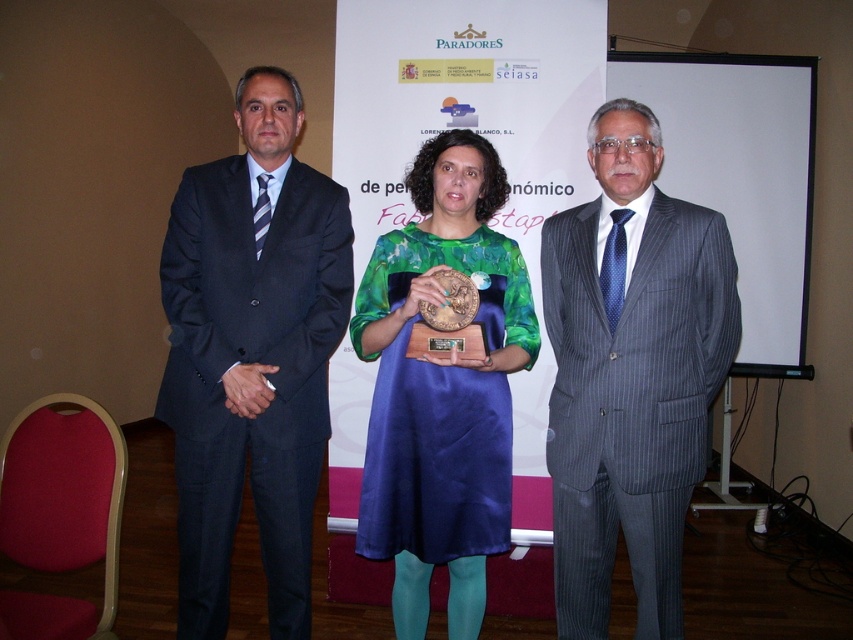
Question: Which of the following is the closest to the observer?

Choices:
 (A) (505, 420)
 (B) (630, 209)

Answer: (B)

Question: Which object appears closest to the camera in this image?

Choices:
 (A) matte black suit at left
 (B) green satin dress at center

Answer: (B)

Question: Is gray pinstripe suit at center positioned before green satin dress at center?

Choices:
 (A) yes
 (B) no

Answer: (A)

Question: Is gray pinstripe suit at center closer to the viewer compared to green satin dress at center?

Choices:
 (A) yes
 (B) no

Answer: (A)

Question: Which point is farther to the camera?

Choices:
 (A) (595, 202)
 (B) (276, 403)
 (C) (431, 513)

Answer: (B)

Question: Can you confirm if matte black suit at left is positioned to the right of green satin dress at center?

Choices:
 (A) yes
 (B) no

Answer: (B)